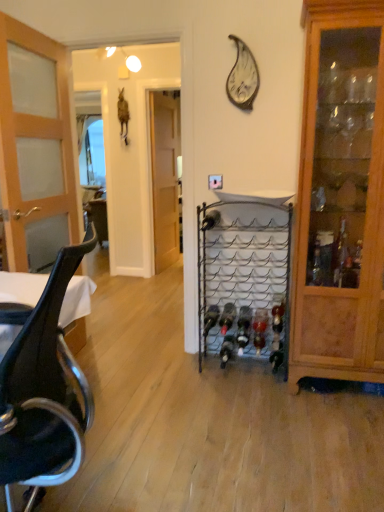
Question: Considering the relative sizes of black glass wine bottle at center, which is the sixth wine bottle in right-to-left order, and light brown wooden door at left, arranged as the first door when viewed from the left, in the image provided, is black glass wine bottle at center, which is the sixth wine bottle in right-to-left order, taller than light brown wooden door at left, arranged as the first door when viewed from the left,?

Choices:
 (A) yes
 (B) no

Answer: (B)

Question: Would you say light brown wooden door at left, which is counted as the 2th door, starting from the back, is part of black glass wine bottle at center, which appears as the 2th wine bottle when viewed from the left,'s contents?

Choices:
 (A) no
 (B) yes

Answer: (A)

Question: Is black glass wine bottle at center, which appears as the 2th wine bottle when viewed from the left, not near light brown wooden door at left, the 1th door positioned from the front?

Choices:
 (A) no
 (B) yes

Answer: (B)

Question: From the image's perspective, does black glass wine bottle at center, which is the sixth wine bottle in right-to-left order, appear lower than light brown wooden door at left, the second door positioned from the right?

Choices:
 (A) yes
 (B) no

Answer: (A)

Question: From the image's perspective, does black glass wine bottle at center, which is the sixth wine bottle in right-to-left order, appear higher than light brown wooden door at left, the second door positioned from the right?

Choices:
 (A) no
 (B) yes

Answer: (A)

Question: Considering the positions of point (215, 274) and point (243, 308), is point (215, 274) closer or farther from the camera than point (243, 308)?

Choices:
 (A) farther
 (B) closer

Answer: (A)

Question: From the image's perspective, is metallic wire wine rack at center above or below translucent glass wine bottle at center, which ranks as the 3th wine bottle in right-to-left order?

Choices:
 (A) below
 (B) above

Answer: (B)

Question: From a real-world perspective, relative to translucent glass wine bottle at center, the 5th wine bottle positioned from the left, is metallic wire wine rack at center vertically above or below?

Choices:
 (A) below
 (B) above

Answer: (B)

Question: Visually, is metallic wire wine rack at center positioned to the left or to the right of translucent glass wine bottle at center, which ranks as the 3th wine bottle in right-to-left order?

Choices:
 (A) left
 (B) right

Answer: (A)

Question: Considering the positions of metallic wire wine rack at center and black leather chair at left in the image, is metallic wire wine rack at center bigger or smaller than black leather chair at left?

Choices:
 (A) big
 (B) small

Answer: (B)

Question: Looking at their shapes, would you say metallic wire wine rack at center is wider or thinner than black leather chair at left?

Choices:
 (A) wide
 (B) thin

Answer: (B)

Question: Is metallic wire wine rack at center situated inside black leather chair at left or outside?

Choices:
 (A) outside
 (B) inside

Answer: (A)

Question: Does point (213, 243) appear closer or farther from the camera than point (24, 393)?

Choices:
 (A) farther
 (B) closer

Answer: (A)

Question: Considering the positions of black leather chair at left and translucent glass wine bottle at center, the 5th wine bottle positioned from the left, in the image, is black leather chair at left wider or thinner than translucent glass wine bottle at center, the 5th wine bottle positioned from the left,?

Choices:
 (A) thin
 (B) wide

Answer: (B)

Question: Is black leather chair at left in front of or behind translucent glass wine bottle at center, which ranks as the 3th wine bottle in right-to-left order, in the image?

Choices:
 (A) behind
 (B) front

Answer: (B)